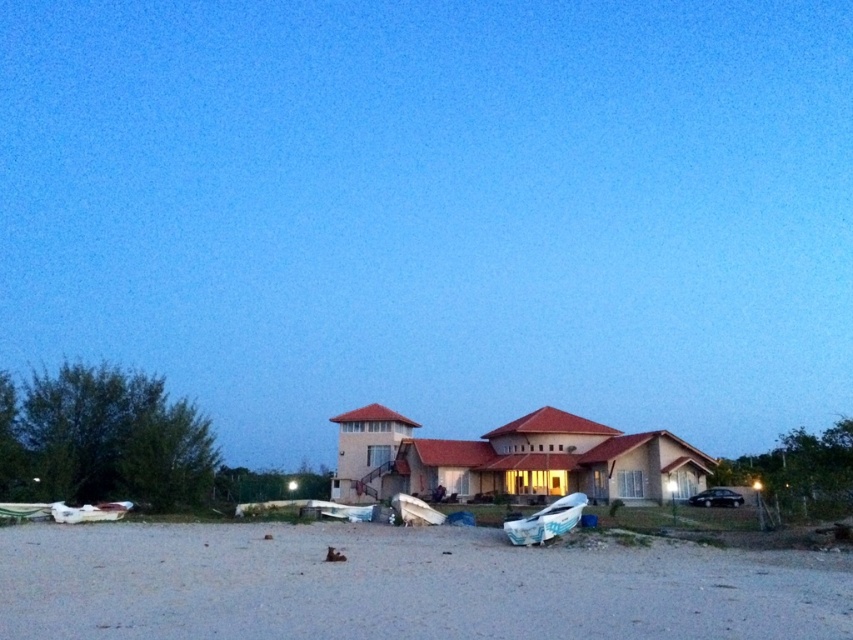
Is gray gravel at lower center closer to camera compared to white plastic boat at lower center?

That is True.

Is gray gravel at lower center further to camera compared to white plastic boat at lower center?

No.

Measure the distance between gray gravel at lower center and camera.

A distance of 10.01 meters exists between gray gravel at lower center and camera.

This screenshot has height=640, width=853. In order to click on gray gravel at lower center in this screenshot , I will do point(401,586).

Who is positioned more to the left, white plastic boat at lower center or white matte boat at center?

white matte boat at center

The height and width of the screenshot is (640, 853). What do you see at coordinates (546, 520) in the screenshot?
I see `white plastic boat at lower center` at bounding box center [546, 520].

Between point (543, 529) and point (430, 524), which one is positioned behind?

The point (430, 524) is behind.

Image resolution: width=853 pixels, height=640 pixels. I want to click on white plastic boat at lower center, so click(x=546, y=520).

Is white plastic boat at lower center taller than white matte boat at lower left?

Correct, white plastic boat at lower center is much taller as white matte boat at lower left.

Does white plastic boat at lower center have a lesser height compared to white matte boat at lower left?

No, white plastic boat at lower center is not shorter than white matte boat at lower left.

Does point (550, 506) come in front of point (126, 509)?

Yes, point (550, 506) is closer to viewer.

Find the location of a particular element. white plastic boat at lower center is located at coordinates (546, 520).